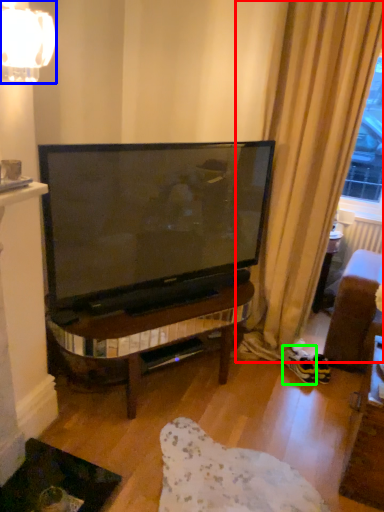
Question: Which object is positioned farthest from curtain (highlighted by a red box)? Select from lamp (highlighted by a blue box) and footwear (highlighted by a green box).

Choices:
 (A) lamp
 (B) footwear

Answer: (A)